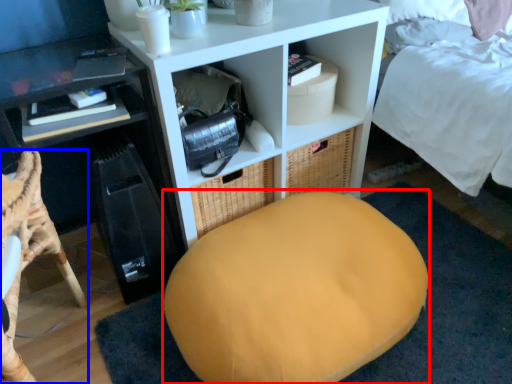
Question: Which object is closer to the camera taking this photo, bean bag chair (highlighted by a red box) or furniture (highlighted by a blue box)?

Choices:
 (A) bean bag chair
 (B) furniture

Answer: (B)